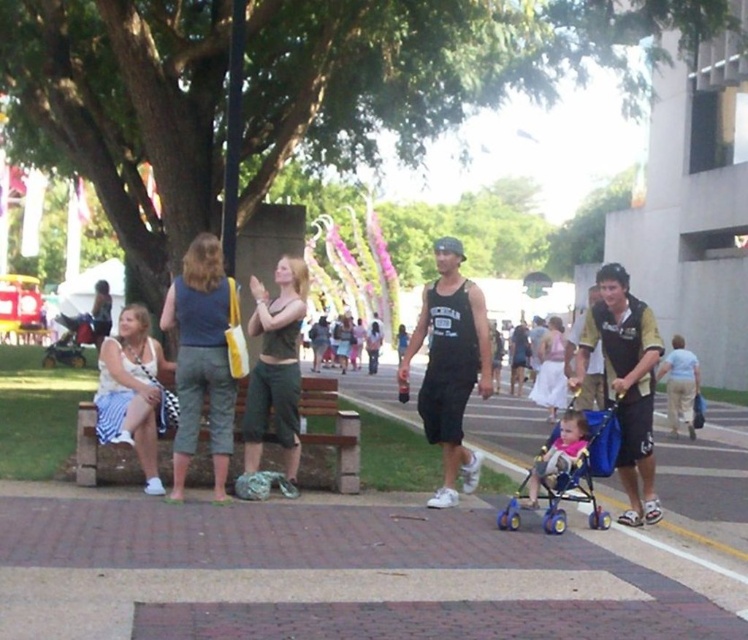
Question: Which point is farther to the camera?

Choices:
 (A) (610, 321)
 (B) (479, 349)
 (C) (34, 561)
 (D) (574, 420)

Answer: (B)

Question: Does black tank top at center have a larger size compared to yellow-green jersey at right?

Choices:
 (A) no
 (B) yes

Answer: (A)

Question: Which object is closer to the camera taking this photo?

Choices:
 (A) orange plastic baby carriage at lower right
 (B) pink fabric stroller at lower right
 (C) brick pavement at lower center
 (D) yellow-green jersey at right

Answer: (C)

Question: Can you confirm if yellow-green jersey at right is positioned to the left of orange plastic baby carriage at lower right?

Choices:
 (A) yes
 (B) no

Answer: (B)

Question: Which object appears farthest from the camera in this image?

Choices:
 (A) black tank top at center
 (B) yellow-green jersey at right
 (C) brick pavement at lower center

Answer: (A)

Question: Is orange plastic baby carriage at lower right to the right of pink fabric stroller at lower right from the viewer's perspective?

Choices:
 (A) yes
 (B) no

Answer: (A)